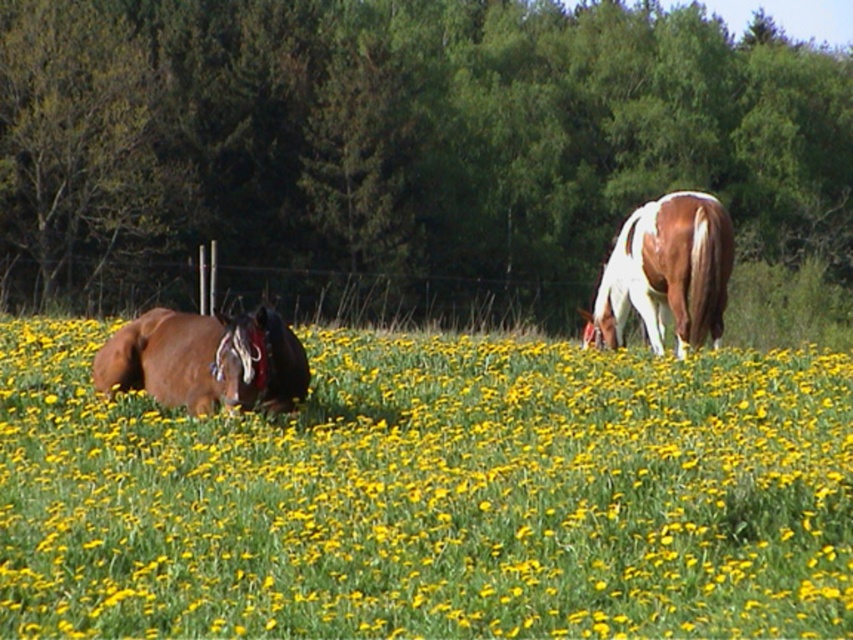
Question: Does brown glossy horse at left have a smaller size compared to white-brown horse at right?

Choices:
 (A) no
 (B) yes

Answer: (B)

Question: Which is farther from the yellow grass at center?

Choices:
 (A) brown glossy horse at left
 (B) white-brown horse at right

Answer: (B)

Question: Does yellow grass at center appear on the right side of brown glossy horse at left?

Choices:
 (A) no
 (B) yes

Answer: (A)

Question: In this image, where is yellow grass at center located relative to white-brown horse at right?

Choices:
 (A) left
 (B) right

Answer: (A)

Question: Which object is positioned closest to the yellow grass at center?

Choices:
 (A) brown glossy horse at left
 (B) white-brown horse at right

Answer: (A)

Question: Which point appears farthest from the camera in this image?

Choices:
 (A) (196, 380)
 (B) (630, 268)
 (C) (693, 422)

Answer: (B)